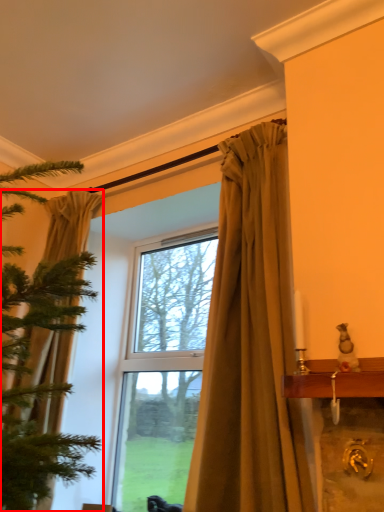
Question: From the image's perspective, what is the correct spatial positioning of curtain (annotated by the red box) in reference to curtain?

Choices:
 (A) above
 (B) below

Answer: (B)